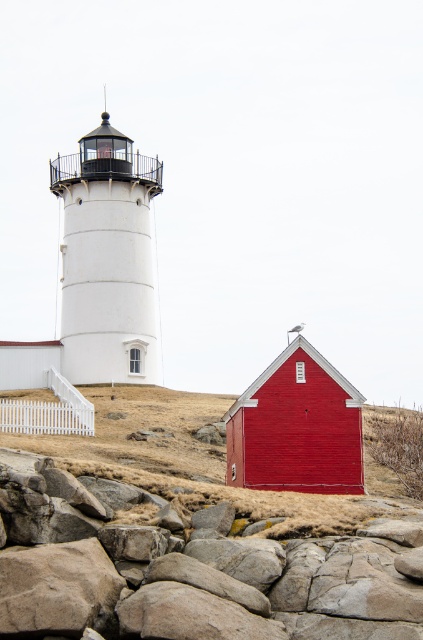
Can you confirm if gray rough rock at lower left is positioned below smooth red barn at center?

Yes.

Between point (88, 525) and point (172, 492), which one is positioned behind?

Point (172, 492)

This screenshot has height=640, width=423. Find the location of `gray rough rock at lower left`. gray rough rock at lower left is located at coordinates (189, 573).